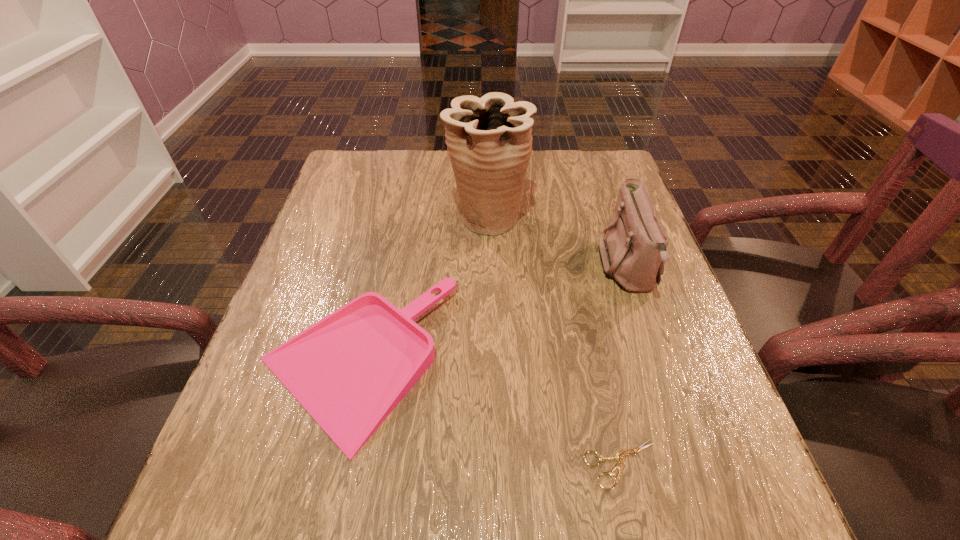
The width and height of the screenshot is (960, 540). What are the coordinates of `object that is at the near edge` in the screenshot? It's located at (620, 456).

Locate an element on the screen. The width and height of the screenshot is (960, 540). object located at the left edge is located at coordinates click(349, 371).

This screenshot has height=540, width=960. In order to click on shoulder bag present at the right edge in this screenshot , I will do `click(634, 253)`.

Locate an element on the screen. shears present at the right edge is located at coordinates (620, 456).

Find the location of a particular element. This screenshot has height=540, width=960. object that is at the near right corner is located at coordinates (620, 456).

Locate an element on the screen. The width and height of the screenshot is (960, 540). vacant space at the near edge is located at coordinates (557, 508).

The height and width of the screenshot is (540, 960). What are the coordinates of `vacant space at the left edge of the desktop` in the screenshot? It's located at (321, 213).

In the image, there is a desktop. Identify the location of vacant space at the right edge. (632, 387).

In the image, there is a desktop. What are the coordinates of `free space at the far left corner` in the screenshot? It's located at (390, 184).

In the image, there is a desktop. At what (x,y) coordinates should I click in order to perform the action: click on vacant region at the near left corner. Please return your answer as a coordinate pair (x, y). Image resolution: width=960 pixels, height=540 pixels. Looking at the image, I should click on (282, 502).